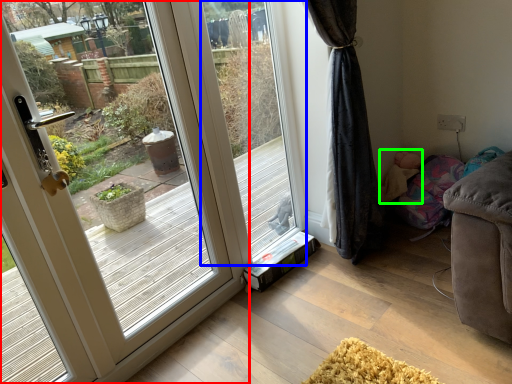
Question: Which object is positioned closest to door (highlighted by a red box)? Select from window screen (highlighted by a blue box) and child (highlighted by a green box).

Choices:
 (A) window screen
 (B) child

Answer: (A)